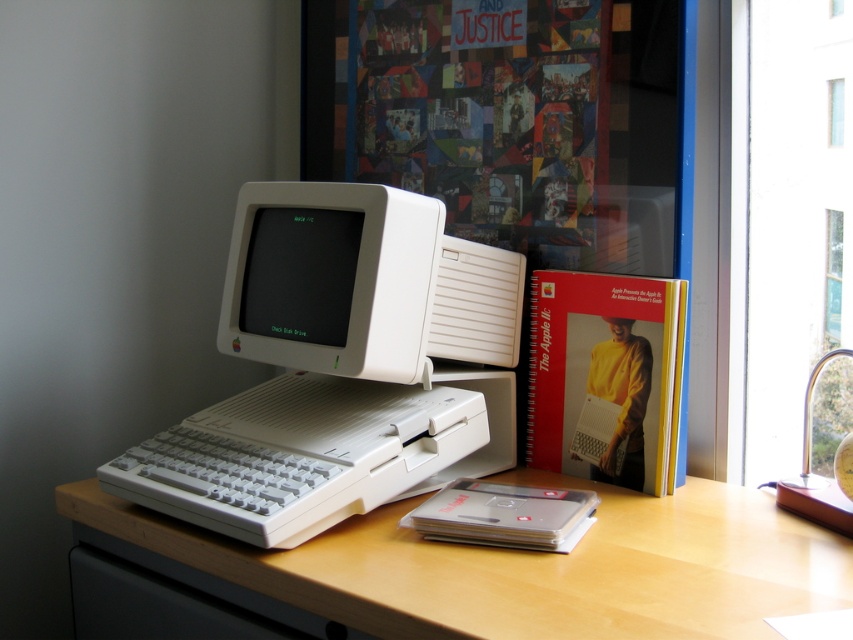
Question: Does white matte computer desk at center appear on the left side of white plastic monitor at center?

Choices:
 (A) yes
 (B) no

Answer: (B)

Question: Is white plastic computer at center wider than white plastic monitor at center?

Choices:
 (A) no
 (B) yes

Answer: (B)

Question: Which of these objects is positioned farthest from the spiral-bound paper at center?

Choices:
 (A) white plastic monitor at center
 (B) black matte monitor at center
 (C) white matte computer desk at center

Answer: (B)

Question: Estimate the real-world distances between objects in this image. Which object is closer to the spiral-bound paper at center?

Choices:
 (A) white plastic monitor at center
 (B) white plastic computer at center
 (C) black matte monitor at center

Answer: (B)

Question: Which point is farther to the camera?

Choices:
 (A) (378, 499)
 (B) (363, 360)
 (C) (326, 324)

Answer: (C)

Question: Considering the relative positions of white matte computer desk at center and spiral-bound paper at center in the image provided, where is white matte computer desk at center located with respect to spiral-bound paper at center?

Choices:
 (A) left
 (B) right

Answer: (A)